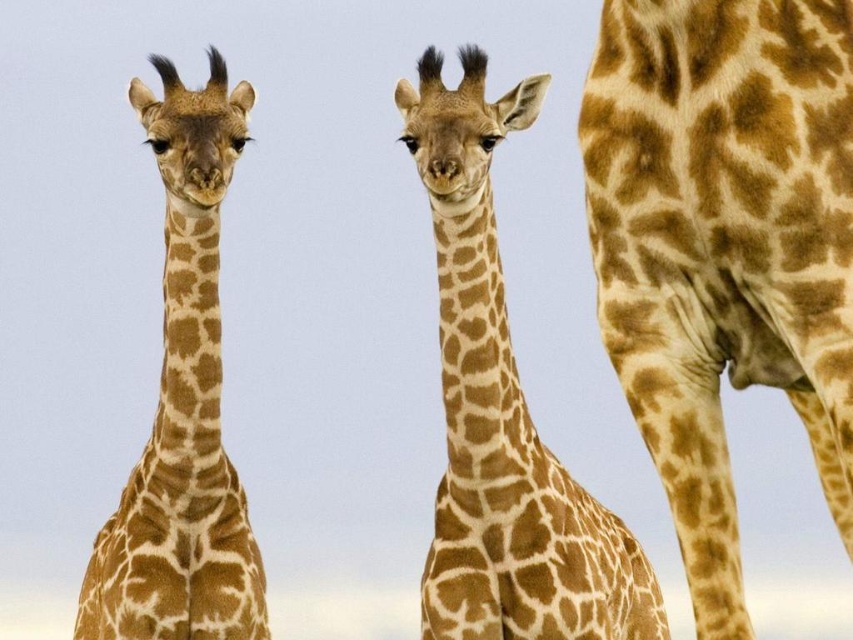
Question: Observing the image, what is the correct spatial positioning of spotted fur giraffe at center in reference to spotted brown giraffe at center?

Choices:
 (A) right
 (B) left

Answer: (A)

Question: Can you confirm if spotted fur giraffe at right is positioned above spotted fur giraffe at center?

Choices:
 (A) yes
 (B) no

Answer: (A)

Question: Which object is closer to the camera taking this photo?

Choices:
 (A) spotted fur giraffe at center
 (B) spotted fur giraffe at right

Answer: (B)

Question: Which point appears farthest from the camera in this image?

Choices:
 (A) (215, 220)
 (B) (746, 300)
 (C) (474, 257)

Answer: (C)

Question: Can you confirm if spotted fur giraffe at center is smaller than spotted brown giraffe at center?

Choices:
 (A) yes
 (B) no

Answer: (B)

Question: Which point is farther to the camera?

Choices:
 (A) spotted brown giraffe at center
 (B) spotted fur giraffe at center
 (C) spotted fur giraffe at right

Answer: (B)